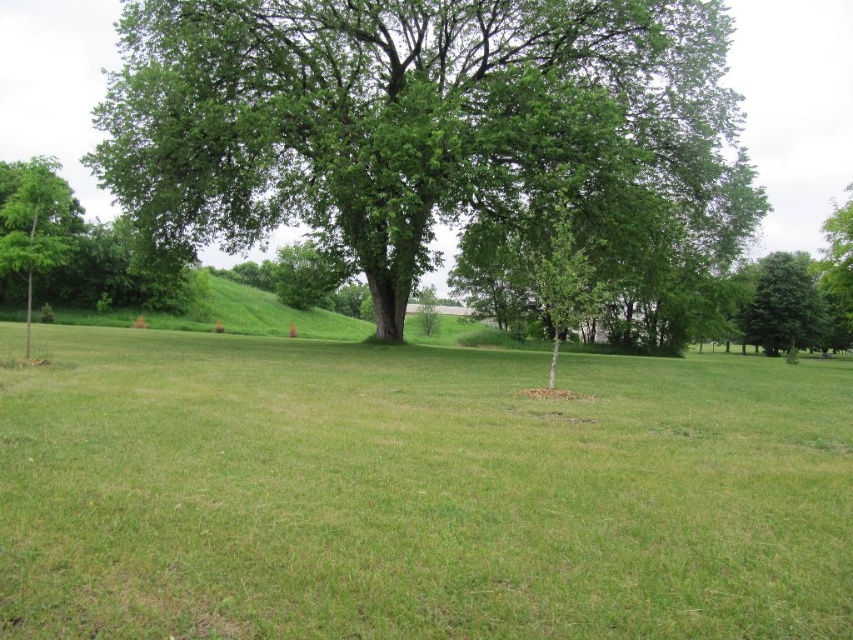
Does green grassy field at center appear on the right side of green leafy tree at right?

In fact, green grassy field at center is to the left of green leafy tree at right.

How far apart are green grassy field at center and green leafy tree at right?

green grassy field at center and green leafy tree at right are 59.14 meters apart from each other.

Who is more distant from viewer, (357,368) or (791,296)?

The point (791,296) is more distant.

Locate an element on the screen. green grassy field at center is located at coordinates (418, 493).

In order to click on green leafy tree at center in this screenshot , I will do `click(425, 125)`.

Does green leafy tree at center appear on the left side of green leafy tree at right?

Correct, you'll find green leafy tree at center to the left of green leafy tree at right.

At what (x,y) coordinates should I click in order to perform the action: click on green leafy tree at center. Please return your answer as a coordinate pair (x, y). Looking at the image, I should click on (425, 125).

Find the location of a particular element. This screenshot has width=853, height=640. green leafy tree at center is located at coordinates (425, 125).

In the scene shown: Who is shorter, green leafy tree at center or green leafy tree at left?

green leafy tree at left is shorter.

Which is in front, point (677, 58) or point (10, 228)?

Point (10, 228) is more forward.

Where is `green leafy tree at center`? Image resolution: width=853 pixels, height=640 pixels. green leafy tree at center is located at coordinates (425, 125).